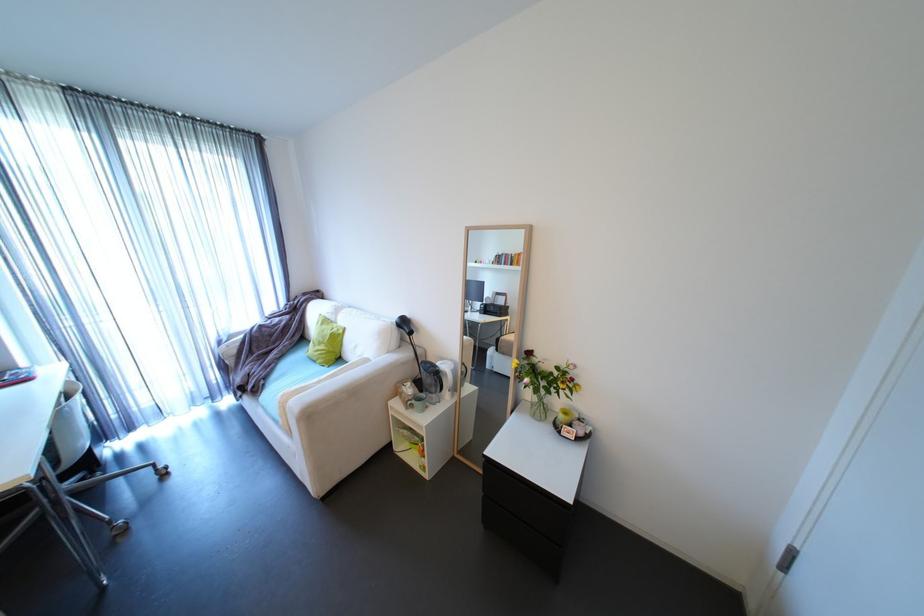
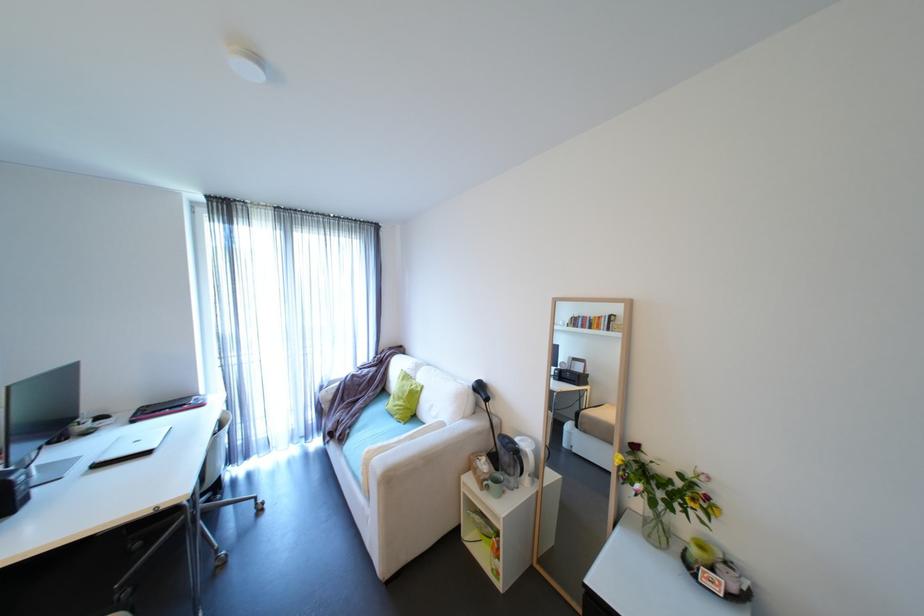
Question: The images are taken continuously from a first-person perspective. In which direction is your viewpoint rotating?

Choices:
 (A) Left
 (B) Right
 (C) Up
 (D) Down

Answer: (A)